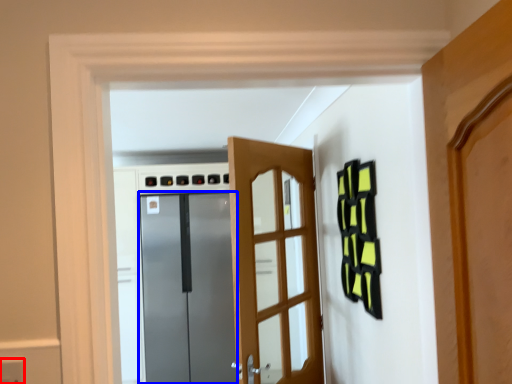
Question: Which of the following is the farthest to the observer, electric outlet (highlighted by a red box) or door (highlighted by a blue box)?

Choices:
 (A) electric outlet
 (B) door

Answer: (B)